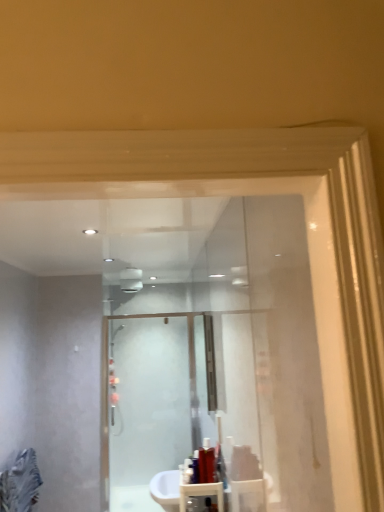
The height and width of the screenshot is (512, 384). Find the location of `shiny red bottle at lower center, which appears as the 2th toiletry when viewed from the back`. shiny red bottle at lower center, which appears as the 2th toiletry when viewed from the back is located at coordinates (187, 471).

Measure the distance between translucent plastic bottle at center, which is counted as the third toiletry, starting from the front, and camera.

The depth of translucent plastic bottle at center, which is counted as the third toiletry, starting from the front, is 2.21 meters.

In order to face white glossy bath at lower center, should I rotate leftwards or rightwards?

It's best to rotate left around 1.725 degrees.

At what (x,y) coordinates should I click in order to perform the action: click on shiny red bottle at lower center, which is the 2th toiletry in front-to-back order. Please return your answer as a coordinate pair (x, y). The height and width of the screenshot is (512, 384). Looking at the image, I should click on [x=187, y=471].

From a real-world perspective, which is physically above, translucent plastic bottle at center, which appears as the first toiletry when viewed from the back, or frosted glass shower door at center?

From a 3D spatial view, frosted glass shower door at center is above.

Would you say translucent plastic bottle at center, which appears as the first toiletry when viewed from the back, is outside frosted glass shower door at center?

Indeed, translucent plastic bottle at center, which appears as the first toiletry when viewed from the back, is completely outside frosted glass shower door at center.

Is there a large distance between translucent plastic bottle at center, which appears as the first toiletry when viewed from the back, and frosted glass shower door at center?

Indeed, translucent plastic bottle at center, which appears as the first toiletry when viewed from the back, is not near frosted glass shower door at center.

Is white glossy bath at lower center looking in the opposite direction of shiny red bottle at lower center, which is the 2th toiletry in front-to-back order?

No, white glossy bath at lower center is not facing the opposite direction of shiny red bottle at lower center, which is the 2th toiletry in front-to-back order.

From the image's perspective, which object appears higher, white glossy bath at lower center or shiny red bottle at lower center, which appears as the 2th toiletry when viewed from the back?

shiny red bottle at lower center, which appears as the 2th toiletry when viewed from the back, from the image's perspective.

Considering the points (206, 495) and (183, 471), which point is behind, point (206, 495) or point (183, 471)?

The point (183, 471) is more distant.

Based on their positions, is white glossy bath at lower center located to the left or right of shiny red bottle at lower center, which appears as the 2th toiletry when viewed from the back?

white glossy bath at lower center is to the left of shiny red bottle at lower center, which appears as the 2th toiletry when viewed from the back.

From the image's perspective, is translucent plastic bottle at center, which is counted as the third toiletry, starting from the front, beneath white glossy bath at lower center?

Incorrect, from the image's perspective, translucent plastic bottle at center, which is counted as the third toiletry, starting from the front, is higher than white glossy bath at lower center.

Can you confirm if translucent plastic bottle at center, which appears as the first toiletry when viewed from the back, is smaller than white glossy bath at lower center?

Yes.

Is translucent plastic bottle at center, which appears as the first toiletry when viewed from the back, in contact with white glossy bath at lower center?

No, translucent plastic bottle at center, which appears as the first toiletry when viewed from the back, is not next to white glossy bath at lower center.

Between shiny red bottle at lower center, marked as the first toiletry in a front-to-back arrangement, and white glossy bath at lower center, which one has larger size?

white glossy bath at lower center.

Can you confirm if shiny red bottle at lower center, the third toiletry positioned from the back, is wider than white glossy bath at lower center?

In fact, shiny red bottle at lower center, the third toiletry positioned from the back, might be narrower than white glossy bath at lower center.

From the picture: From a real-world perspective, is shiny red bottle at lower center, which appears as the second toiletry when viewed from the left, positioned above or below white glossy bath at lower center?

Clearly, from a real-world perspective, shiny red bottle at lower center, which appears as the second toiletry when viewed from the left, is above white glossy bath at lower center.

Find the location of a particular element. The height and width of the screenshot is (512, 384). the 2nd toiletry to the right of the shiny red bottle at lower center, the 1th toiletry when ordered from left to right, counting from the anchor's position is located at coordinates (206, 462).

How far apart are shiny red bottle at lower center, which is the 2th toiletry in front-to-back order, and translucent plastic bottle at center, which is the third toiletry from left to right?

4.60 inches.

Between shiny red bottle at lower center, the 1th toiletry when ordered from left to right, and translucent plastic bottle at center, which appears as the first toiletry when viewed from the back, which one has more height?

translucent plastic bottle at center, which appears as the first toiletry when viewed from the back, is taller.

Is shiny red bottle at lower center, which is counted as the third toiletry, starting from the right, looking in the opposite direction of translucent plastic bottle at center, marked as the first toiletry in a right-to-left arrangement?

No.

Is frosted glass shower door at center looking in the opposite direction of white glossy bath at lower center?

No, frosted glass shower door at center is not facing away from white glossy bath at lower center.

Is frosted glass shower door at center far from white glossy bath at lower center?

Yes, frosted glass shower door at center and white glossy bath at lower center are located far from each other.

From a real-world perspective, is frosted glass shower door at center physically above white glossy bath at lower center?

Yes, from a real-world perspective, frosted glass shower door at center is on top of white glossy bath at lower center.

Is frosted glass shower door at center facing away from translucent plastic bottle at center, which appears as the first toiletry when viewed from the back?

frosted glass shower door at center does not have its back to translucent plastic bottle at center, which appears as the first toiletry when viewed from the back.

Consider the image. From a real-world perspective, which object stands above the other?

In real-world perspective, frosted glass shower door at center is above.

How many degrees apart are the facing directions of frosted glass shower door at center and translucent plastic bottle at center, which is the third toiletry from left to right?

91.8 degrees separate the facing orientations of frosted glass shower door at center and translucent plastic bottle at center, which is the third toiletry from left to right.

From the image's perspective, is frosted glass shower door at center above or below translucent plastic bottle at center, which is the third toiletry from left to right?

Based on their image positions, frosted glass shower door at center is located beneath translucent plastic bottle at center, which is the third toiletry from left to right.

This screenshot has height=512, width=384. What are the coordinates of `the 1st toiletry in front when counting from the frosted glass shower door at center` in the screenshot? It's located at (206, 462).

Where is `the 1st toiletry positioned above the white glossy bath at lower center (from a real-world perspective)`? the 1st toiletry positioned above the white glossy bath at lower center (from a real-world perspective) is located at coordinates click(187, 471).

Considering their positions, is frosted glass shower door at center positioned closer to translucent plastic bottle at center, which is the third toiletry from left to right, than shiny red bottle at lower center, which appears as the second toiletry when viewed from the left?

The object closer to translucent plastic bottle at center, which is the third toiletry from left to right, is shiny red bottle at lower center, which appears as the second toiletry when viewed from the left.

Considering their positions, is shiny red bottle at lower center, marked as the first toiletry in a front-to-back arrangement, positioned closer to translucent plastic bottle at center, marked as the first toiletry in a right-to-left arrangement, than shiny red bottle at lower center, the 1th toiletry when ordered from left to right?

shiny red bottle at lower center, marked as the first toiletry in a front-to-back arrangement, lies closer to translucent plastic bottle at center, marked as the first toiletry in a right-to-left arrangement, than the other object.

Looking at the image, which one is located closer to frosted glass shower door at center, white glossy bath at lower center or shiny red bottle at lower center, which appears as the second toiletry when viewed from the left?

white glossy bath at lower center.

Estimate the real-world distances between objects in this image. Which object is further from translucent plastic bottle at center, which is counted as the third toiletry, starting from the front, shiny red bottle at lower center, which is counted as the third toiletry, starting from the right, or white glossy bath at lower center?

white glossy bath at lower center is positioned further to the anchor translucent plastic bottle at center, which is counted as the third toiletry, starting from the front.

Looking at the image, which one is located closer to white glossy bath at lower center, shiny red bottle at lower center, which appears as the second toiletry when viewed from the left, or frosted glass shower door at center?

shiny red bottle at lower center, which appears as the second toiletry when viewed from the left.

Looking at the image, which one is located further to white glossy bath at lower center, frosted glass shower door at center or shiny red bottle at lower center, which appears as the 2th toiletry when viewed from the back?

Among the two, frosted glass shower door at center is located further to white glossy bath at lower center.

From the image, which object appears to be farther from translucent plastic bottle at center, marked as the first toiletry in a right-to-left arrangement, white glossy bath at lower center or shiny red bottle at lower center, which appears as the second toiletry when viewed from the left?

white glossy bath at lower center is further to translucent plastic bottle at center, marked as the first toiletry in a right-to-left arrangement.

Which object lies nearer to the anchor point white glossy bath at lower center, translucent plastic bottle at center, marked as the first toiletry in a right-to-left arrangement, or frosted glass shower door at center?

Based on the image, translucent plastic bottle at center, marked as the first toiletry in a right-to-left arrangement, appears to be nearer to white glossy bath at lower center.

Identify the location of toiletry between translucent plastic bottle at center, marked as the first toiletry in a right-to-left arrangement, and white glossy bath at lower center from top to bottom. point(187,471).

Identify the location of bath between translucent plastic bottle at center, which is counted as the third toiletry, starting from the front, and frosted glass shower door at center from front to back. This screenshot has height=512, width=384. [181, 490].

Where is `toiletry between shiny red bottle at lower center, which appears as the 2th toiletry when viewed from the back, and frosted glass shower door at center from front to back`? toiletry between shiny red bottle at lower center, which appears as the 2th toiletry when viewed from the back, and frosted glass shower door at center from front to back is located at coordinates (206, 462).

Locate an element on the screen. toiletry between shiny red bottle at lower center, marked as the first toiletry in a front-to-back arrangement, and translucent plastic bottle at center, which appears as the first toiletry when viewed from the back, from front to back is located at coordinates (187, 471).